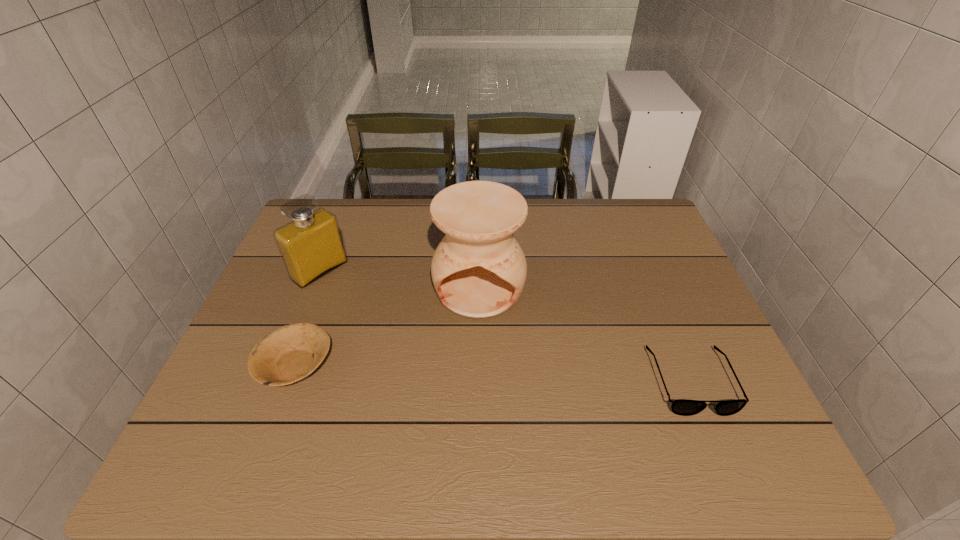
Locate an element on the screen. This screenshot has width=960, height=540. free space located on the front-facing side of the perfume is located at coordinates (381, 319).

Identify the location of bowl that is at the near edge. (289, 354).

Locate an element on the screen. The image size is (960, 540). spectacles positioned at the near edge is located at coordinates (684, 407).

Locate an element on the screen. bowl situated at the left edge is located at coordinates (289, 354).

Locate an element on the screen. perfume positioned at the left edge is located at coordinates (311, 246).

Where is `object that is positioned at the right edge`? The image size is (960, 540). object that is positioned at the right edge is located at coordinates tap(684, 407).

The width and height of the screenshot is (960, 540). I want to click on object that is at the near left corner, so click(289, 354).

I want to click on object at the near right corner, so click(x=684, y=407).

I want to click on free space at the far edge of the desktop, so click(x=387, y=223).

At what (x,y) coordinates should I click in order to perform the action: click on vacant region at the near edge of the desktop. Please return your answer as a coordinate pair (x, y). This screenshot has width=960, height=540. Looking at the image, I should click on (579, 404).